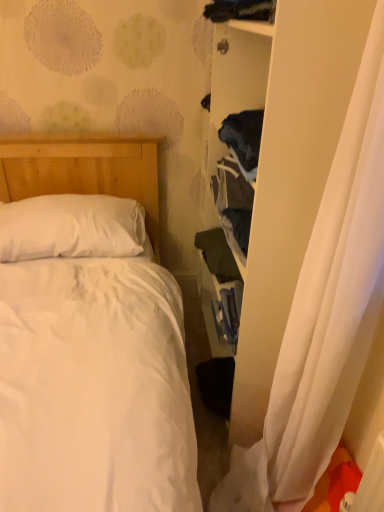
Describe the element at coordinates (240, 10) in the screenshot. I see `dark blue fabric at upper center, the 1th clothing in the front-to-back sequence` at that location.

Measure the distance between dark blue fabric at upper center, the 1th clothing in the front-to-back sequence, and camera.

dark blue fabric at upper center, the 1th clothing in the front-to-back sequence, and camera are 4.46 feet apart.

From the picture: What is the approximate height of white soft pillow at upper left?

The height of white soft pillow at upper left is 9.84 inches.

What do you see at coordinates (71, 227) in the screenshot? This screenshot has width=384, height=512. I see `white soft pillow at upper left` at bounding box center [71, 227].

Describe the element at coordinates (324, 313) in the screenshot. This screenshot has width=384, height=512. I see `white sheer curtain at right` at that location.

This screenshot has width=384, height=512. What do you see at coordinates (217, 255) in the screenshot? I see `dark green fabric at center-right, acting as the first clothing starting from the back` at bounding box center [217, 255].

Where is `dark blue fabric at upper center, the 1th clothing in the front-to-back sequence`? This screenshot has height=512, width=384. dark blue fabric at upper center, the 1th clothing in the front-to-back sequence is located at coordinates (240, 10).

What's the angular difference between white sheer curtain at right and dark green fabric at center-right, the 2th clothing when ordered from top to bottom,'s facing directions?

The facing directions of white sheer curtain at right and dark green fabric at center-right, the 2th clothing when ordered from top to bottom, are 1.71 degrees apart.

Considering the points (361, 60) and (230, 267), which point is in front, point (361, 60) or point (230, 267)?

The point (361, 60) is more forward.

Which object is positioned more to the left, white sheer curtain at right or dark green fabric at center-right, placed as the 1th clothing when sorted from bottom to top?

dark green fabric at center-right, placed as the 1th clothing when sorted from bottom to top, is more to the left.

This screenshot has height=512, width=384. Identify the location of curtain above the dark green fabric at center-right, the 2th clothing when ordered from top to bottom (from a real-world perspective). click(x=324, y=313).

Considering the relative sizes of dark blue fabric at upper center, the 1th clothing in the front-to-back sequence, and white sheer curtain at right in the image provided, is dark blue fabric at upper center, the 1th clothing in the front-to-back sequence, smaller than white sheer curtain at right?

Correct, dark blue fabric at upper center, the 1th clothing in the front-to-back sequence, occupies less space than white sheer curtain at right.

Can you confirm if dark blue fabric at upper center, which appears as the first clothing when viewed from the top, is wider than white sheer curtain at right?

In fact, dark blue fabric at upper center, which appears as the first clothing when viewed from the top, might be narrower than white sheer curtain at right.

Is dark blue fabric at upper center, the 1th clothing in the front-to-back sequence, positioned in front of white sheer curtain at right?

That is False.

Between point (241, 19) and point (362, 222), which one is positioned in front?

Point (362, 222)

Is dark blue fabric at upper center, which appears as the first clothing when viewed from the top, facing away from dark green fabric at center-right, the 2th clothing when ordered from top to bottom?

dark blue fabric at upper center, which appears as the first clothing when viewed from the top, does not have its back to dark green fabric at center-right, the 2th clothing when ordered from top to bottom.

Identify the location of clothing on the right of the dark green fabric at center-right, acting as the first clothing starting from the back. The image size is (384, 512). (240, 10).

Between dark blue fabric at upper center, the second clothing in the bottom-to-top sequence, and dark green fabric at center-right, the 2th clothing when ordered from top to bottom, which one is positioned in front?

dark blue fabric at upper center, the second clothing in the bottom-to-top sequence, is closer to the camera.

From a real-world perspective, is dark green fabric at center-right, the 2th clothing when ordered from top to bottom, over dark blue fabric at upper center, the second clothing in the bottom-to-top sequence?

No, from a real-world perspective, dark green fabric at center-right, the 2th clothing when ordered from top to bottom, is not over dark blue fabric at upper center, the second clothing in the bottom-to-top sequence

Would you say dark green fabric at center-right, positioned as the 2th clothing in front-to-back order, contains dark blue fabric at upper center, the second clothing in the bottom-to-top sequence?

No, dark blue fabric at upper center, the second clothing in the bottom-to-top sequence, is not a part of dark green fabric at center-right, positioned as the 2th clothing in front-to-back order.

From the image's perspective, is dark green fabric at center-right, placed as the 1th clothing when sorted from bottom to top, located above or below dark blue fabric at upper center, which appears as the first clothing when viewed from the top?

Clearly, from the image's perspective, dark green fabric at center-right, placed as the 1th clothing when sorted from bottom to top, is below dark blue fabric at upper center, which appears as the first clothing when viewed from the top.

Does dark green fabric at center-right, positioned as the 2th clothing in front-to-back order, lie in front of dark blue fabric at upper center, the 1th clothing in the front-to-back sequence?

That is False.

Is dark green fabric at center-right, the 2th clothing when ordered from top to bottom, shorter than white soft pillow at upper left?

Yes, dark green fabric at center-right, the 2th clothing when ordered from top to bottom, is shorter than white soft pillow at upper left.

Between dark green fabric at center-right, placed as the 1th clothing when sorted from bottom to top, and white soft pillow at upper left, which one has smaller width?

dark green fabric at center-right, placed as the 1th clothing when sorted from bottom to top.

From the image's perspective, is dark green fabric at center-right, acting as the first clothing starting from the back, beneath white soft pillow at upper left?

Indeed, from the image's perspective, dark green fabric at center-right, acting as the first clothing starting from the back, is shown beneath white soft pillow at upper left.

Is dark green fabric at center-right, positioned as the 2th clothing in front-to-back order, at the left side of white soft pillow at upper left?

No, dark green fabric at center-right, positioned as the 2th clothing in front-to-back order, is not to the left of white soft pillow at upper left.

Based on their sizes in the image, would you say white soft pillow at upper left is bigger or smaller than white sheer curtain at right?

Clearly, white soft pillow at upper left is smaller in size than white sheer curtain at right.

The height and width of the screenshot is (512, 384). There is a white soft pillow at upper left. Find the location of `curtain above it (from a real-world perspective)`. curtain above it (from a real-world perspective) is located at coordinates [x=324, y=313].

Is white soft pillow at upper left turned away from white sheer curtain at right?

No, white soft pillow at upper left is not facing away from white sheer curtain at right.

Does white soft pillow at upper left appear on the right side of white sheer curtain at right?

No.

From a real-world perspective, is white sheer curtain at right over white soft pillow at upper left?

Indeed, from a real-world perspective, white sheer curtain at right stands above white soft pillow at upper left.

Looking at this image, is white sheer curtain at right completely or partially outside of white soft pillow at upper left?

Absolutely, white sheer curtain at right is external to white soft pillow at upper left.

Is white sheer curtain at right wider or thinner than white soft pillow at upper left?

white sheer curtain at right is wider than white soft pillow at upper left.

Can you tell me how much white sheer curtain at right and white soft pillow at upper left differ in facing direction?

They differ by 91.5 degrees in their facing directions.

In the image, there is a white sheer curtain at right. Find the location of `clothing below it (from a real-world perspective)`. clothing below it (from a real-world perspective) is located at coordinates (217, 255).

In order to click on the 1st clothing behind the white sheer curtain at right in this screenshot , I will do point(240,10).

Which object lies further to the anchor point dark blue fabric at upper center, the 1th clothing in the front-to-back sequence, dark green fabric at center-right, placed as the 1th clothing when sorted from bottom to top, or white soft pillow at upper left?

The object further to dark blue fabric at upper center, the 1th clothing in the front-to-back sequence, is white soft pillow at upper left.

In the scene shown: Considering their positions, is dark blue fabric at upper center, which appears as the first clothing when viewed from the top, positioned closer to white sheer curtain at right than white soft pillow at upper left?

white soft pillow at upper left lies closer to white sheer curtain at right than the other object.

When comparing their distances from white soft pillow at upper left, does dark blue fabric at upper center, which appears as the first clothing when viewed from the top, or dark green fabric at center-right, the 2th clothing when ordered from top to bottom, seem closer?

The object closer to white soft pillow at upper left is dark green fabric at center-right, the 2th clothing when ordered from top to bottom.

Based on the photo, looking at the image, which one is located closer to white soft pillow at upper left, dark green fabric at center-right, positioned as the 2th clothing in front-to-back order, or dark blue fabric at upper center, acting as the second clothing starting from the back?

dark green fabric at center-right, positioned as the 2th clothing in front-to-back order, is closer to white soft pillow at upper left.

Based on their spatial positions, is white sheer curtain at right or white soft pillow at upper left closer to dark green fabric at center-right, positioned as the 2th clothing in front-to-back order?

white soft pillow at upper left is positioned closer to the anchor dark green fabric at center-right, positioned as the 2th clothing in front-to-back order.

Based on their spatial positions, is white soft pillow at upper left or dark green fabric at center-right, the 2th clothing when ordered from top to bottom, closer to dark blue fabric at upper center, which appears as the first clothing when viewed from the top?

dark green fabric at center-right, the 2th clothing when ordered from top to bottom, lies closer to dark blue fabric at upper center, which appears as the first clothing when viewed from the top, than the other object.

Considering their positions, is white sheer curtain at right positioned closer to white soft pillow at upper left than dark blue fabric at upper center, which appears as the first clothing when viewed from the top?

white sheer curtain at right lies closer to white soft pillow at upper left than the other object.

Looking at the image, which one is located closer to dark blue fabric at upper center, which appears as the first clothing when viewed from the top, white sheer curtain at right or white soft pillow at upper left?

Among the two, white soft pillow at upper left is located nearer to dark blue fabric at upper center, which appears as the first clothing when viewed from the top.

The width and height of the screenshot is (384, 512). Find the location of `pillow between dark blue fabric at upper center, which appears as the first clothing when viewed from the top, and dark green fabric at center-right, positioned as the 2th clothing in front-to-back order, vertically`. pillow between dark blue fabric at upper center, which appears as the first clothing when viewed from the top, and dark green fabric at center-right, positioned as the 2th clothing in front-to-back order, vertically is located at coordinates (71, 227).

Where is `clothing between white sheer curtain at right and dark green fabric at center-right, positioned as the 2th clothing in front-to-back order, from front to back`? The height and width of the screenshot is (512, 384). clothing between white sheer curtain at right and dark green fabric at center-right, positioned as the 2th clothing in front-to-back order, from front to back is located at coordinates (240, 10).